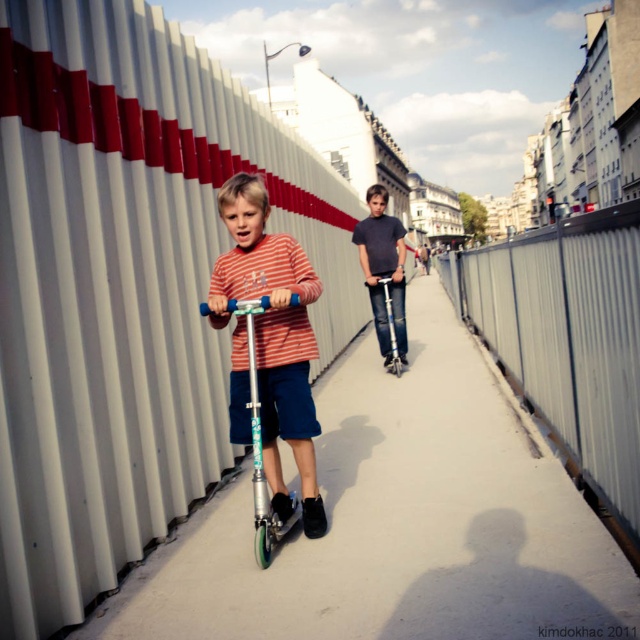
You are standing at the point labeled as point (358, 376) in the image. A child on a scooter is approaching you from the direction of the buildings in the distance. If the child is moving at a speed of 3 meters per second, how many seconds will it take for the child to reach your position?

The point labeled as point (358, 376) is 7.73 meters away from the viewer. Since the child is moving at 3 meters per second, it will take approximately 2.58 seconds for the child to reach the position of the point (358, 376).

You are a delivery robot trying to navigate through the pathway. You see a white corrugated metal fence at center and a teal glossy scooter at center. Which object is taller and could potentially block your path?

The white corrugated metal fence at center is taller than the teal glossy scooter at center, so it could potentially block your path.

You are a delivery drone flying above the pathway and need to land near the metallic silver fence at right and the matte gray shirt at center. Which object should you aim for to land closer to the ground?

The metallic silver fence at right is closer to the viewer than the matte gray shirt at center, so you should aim for the metallic silver fence at right to land closer to the ground.